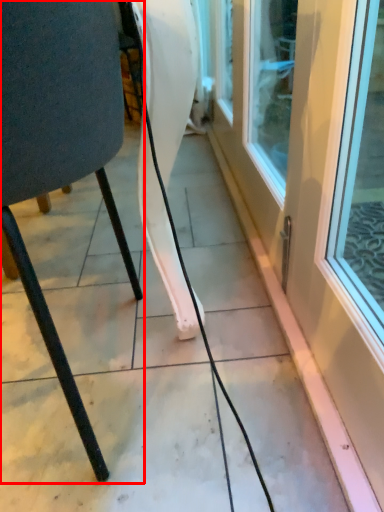
Question: From the image, what is the correct spatial relationship of chair (annotated by the red box) in relation to door?

Choices:
 (A) left
 (B) right

Answer: (A)